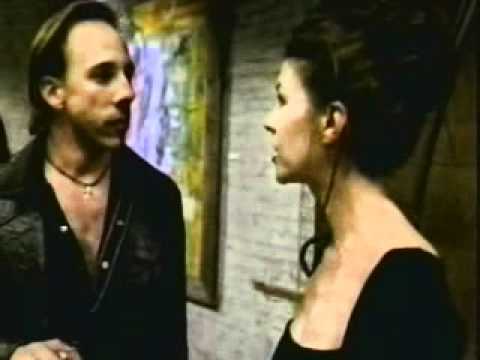
At what (x,y) coordinates should I click in order to perform the action: click on green and purple painting. Please return your answer as a coordinate pair (x, y). The image size is (480, 360). Looking at the image, I should click on (176, 65).